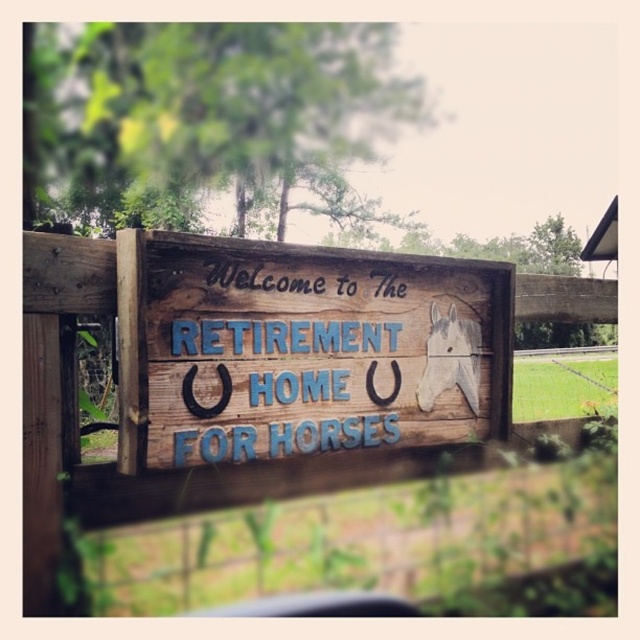
You are standing in front of the sign at The Retirement Home for Horses. There are two points marked on the sign. One is at coordinate point (42,298) and the other is at point (208,396). Which point is closer to you?

Point (42,298) is closer to the camera than point (208,396).